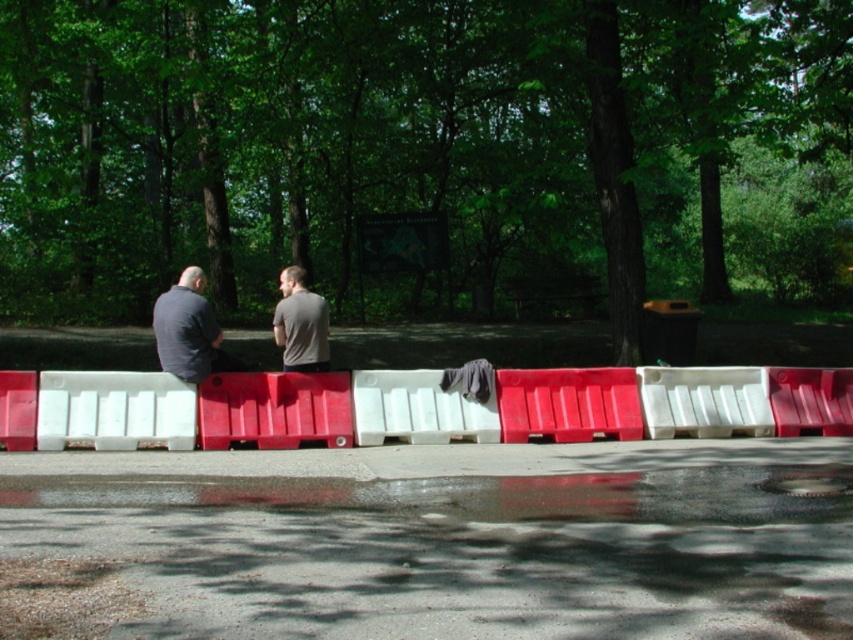
You are standing at the point marked by the coordinates point [189,410] in the image. What object are you standing on?

The point [189,410] indicates the white plastic barrier at center, so you are standing on the white plastic barrier at center.

You are a maintenance worker who needs to replace the white plastic barrier at center and the metallic red bench at lower right. Which object requires a larger replacement part?

The white plastic barrier at center requires a larger replacement part since it has a larger size compared to the metallic red bench at lower right.

In the scene shown: You are a delivery drone flying over a park. You need to land precisely on the white plastic barrier at center. What coordinates should you target for landing?

The white plastic barrier at center is located at coordinates point (189, 410), so you should target those coordinates for landing.